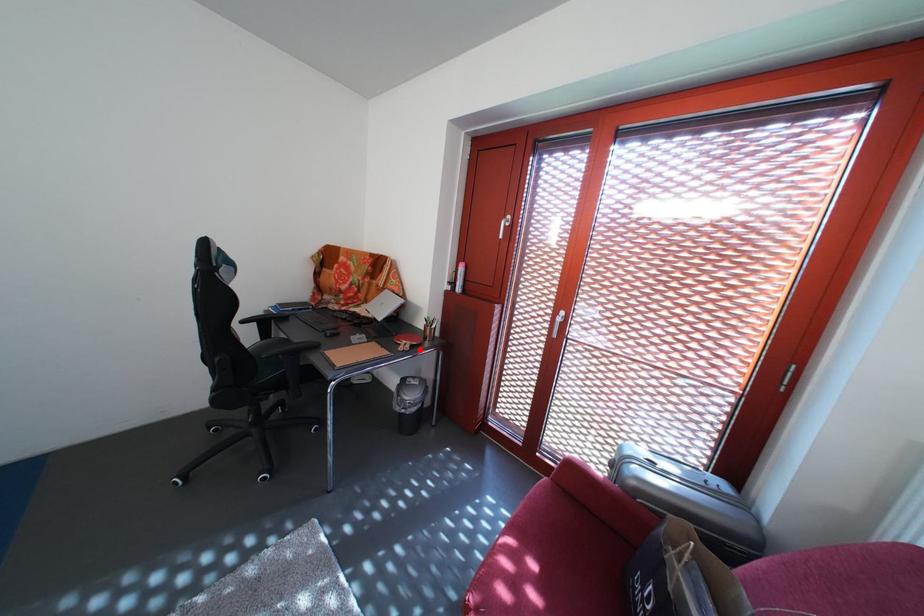
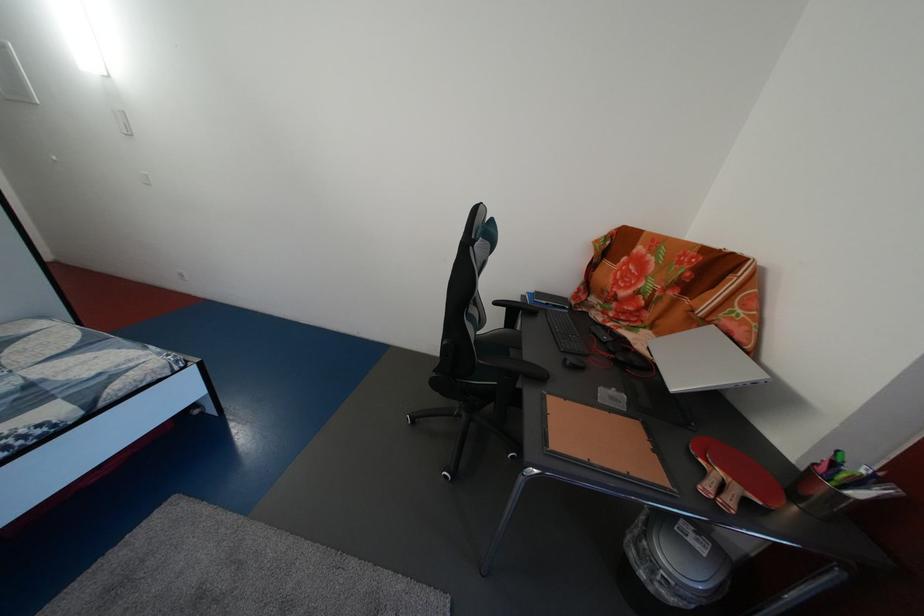
Question: I am providing you with two images of the same scene from different viewpoints. A red point is marked on the first image. At the location where the point appears in image 1, is it still visible in image 2?

Choices:
 (A) Yes
 (B) No

Answer: (A)